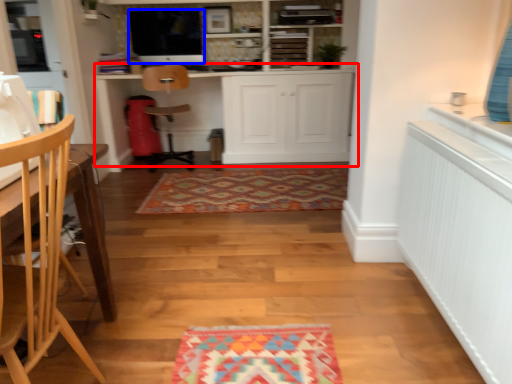
Question: Which of the following is the farthest to the observer, cabinetry (highlighted by a red box) or appliance (highlighted by a blue box)?

Choices:
 (A) cabinetry
 (B) appliance

Answer: (B)